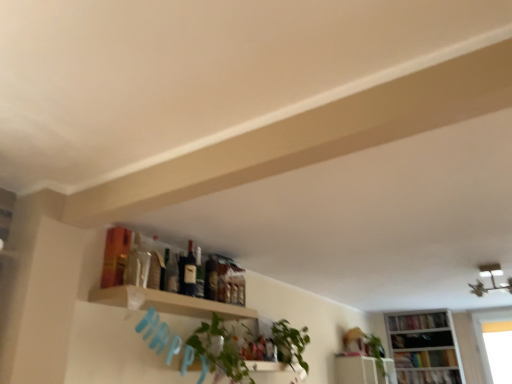
Question: Is matte glass bottle at center, arranged as the 1th bottle when viewed from the front, in front of green leafy plant at center?

Choices:
 (A) no
 (B) yes

Answer: (A)

Question: Is matte glass bottle at center, which appears as the 2th bottle when viewed from the back, surrounding green leafy plant at center?

Choices:
 (A) no
 (B) yes

Answer: (A)

Question: Is matte glass bottle at center, arranged as the 1th bottle when viewed from the front, smaller than green leafy plant at center?

Choices:
 (A) yes
 (B) no

Answer: (A)

Question: From the image's perspective, is matte glass bottle at center, which appears as the 2th bottle when viewed from the back, beneath green leafy plant at center?

Choices:
 (A) yes
 (B) no

Answer: (B)

Question: Is matte glass bottle at center, which appears as the 2th bottle when viewed from the back, shorter than green leafy plant at center?

Choices:
 (A) yes
 (B) no

Answer: (A)

Question: From the image's perspective, is white wooden bookcase at lower right located above or below green leafy plant at center?

Choices:
 (A) below
 (B) above

Answer: (A)

Question: Does point (424, 382) appear closer or farther from the camera than point (291, 339)?

Choices:
 (A) farther
 (B) closer

Answer: (A)

Question: Based on their positions, is white wooden bookcase at lower right located to the left or right of green leafy plant at center?

Choices:
 (A) right
 (B) left

Answer: (A)

Question: From their relative heights in the image, would you say white wooden bookcase at lower right is taller or shorter than green leafy plant at center?

Choices:
 (A) short
 (B) tall

Answer: (B)

Question: From a real-world perspective, relative to hardcover book at lower right, which appears as the 2th book when viewed from the top, is green glass bottle at center, positioned as the 1th bottle in back-to-front order, vertically above or below?

Choices:
 (A) above
 (B) below

Answer: (A)

Question: Is point (196, 249) closer or farther from the camera than point (404, 357)?

Choices:
 (A) closer
 (B) farther

Answer: (A)

Question: Considering the positions of green glass bottle at center, positioned as the 1th bottle in back-to-front order, and hardcover book at lower right, which appears as the 2th book when viewed from the top, in the image, is green glass bottle at center, positioned as the 1th bottle in back-to-front order, wider or thinner than hardcover book at lower right, which appears as the 2th book when viewed from the top,?

Choices:
 (A) thin
 (B) wide

Answer: (A)

Question: From the image's perspective, is green glass bottle at center, the 2th bottle positioned from the front, located above or below hardcover book at lower right, which is the second book in bottom-to-top order?

Choices:
 (A) above
 (B) below

Answer: (A)

Question: Choose the correct answer: Is wooden shelf at upper center, the 2th shelf ordered from the bottom, inside white glossy shelf at upper center, which is the 2th shelf from front to back, or outside it?

Choices:
 (A) inside
 (B) outside

Answer: (B)

Question: In the image, is wooden shelf at upper center, the 1th shelf from the top, on the left side or the right side of white glossy shelf at upper center, which is the 2th shelf in top-to-bottom order?

Choices:
 (A) right
 (B) left

Answer: (B)